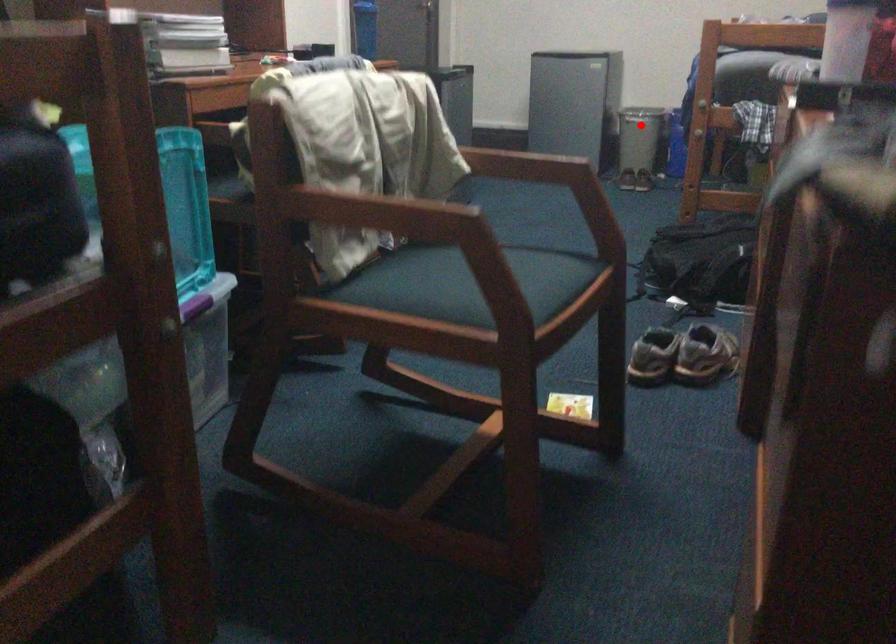
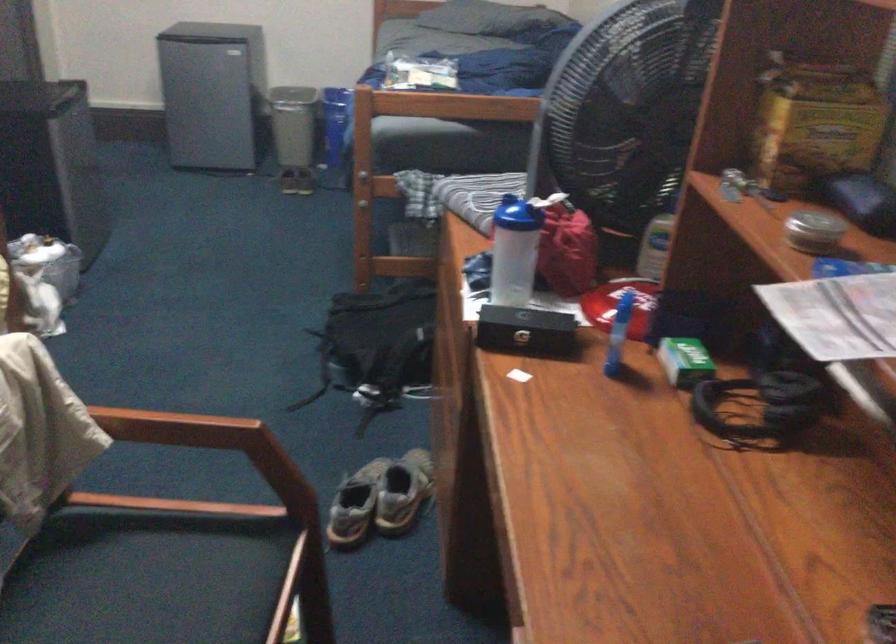
Where in the second image is the point corresponding to the highlighted location from the first image?

(293, 124)